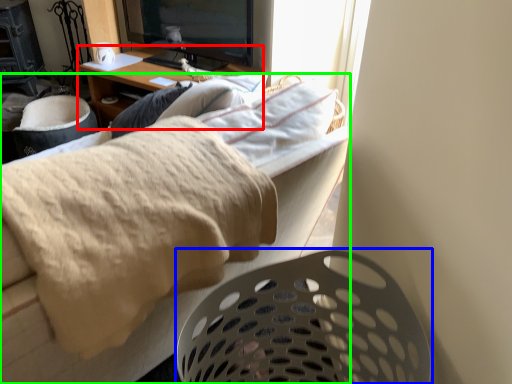
Question: Based on their relative distances, which object is farther from desk (highlighted by a red box)? Choose from laundry basket (highlighted by a blue box) and furniture (highlighted by a green box).

Choices:
 (A) laundry basket
 (B) furniture

Answer: (A)